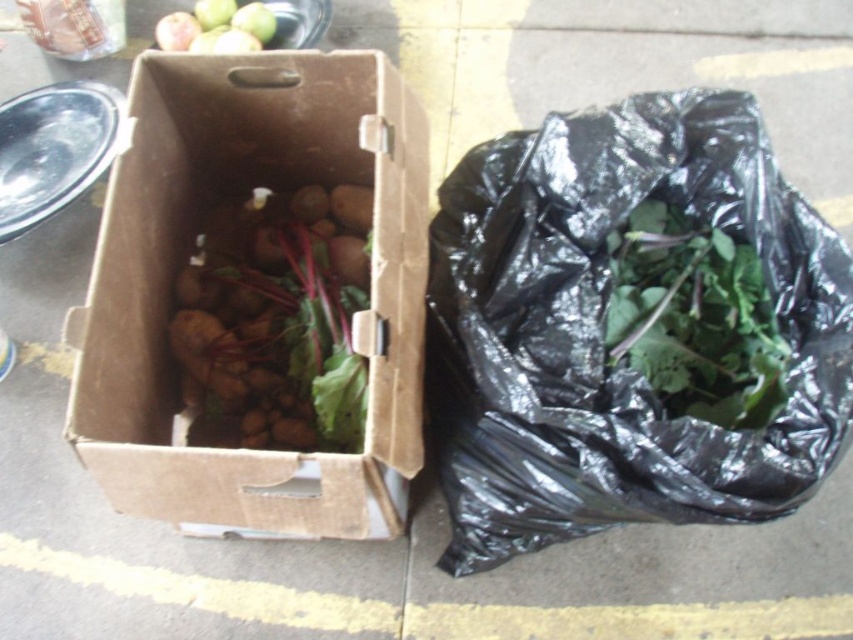
You are a delivery person who needs to pick up the black plastic bag at right and the green leafy at right from the sidewalk. Which item should you pick up first to avoid stepping on the other?

You should pick up the black plastic bag at right first because it is in front of the green leafy at right, so picking it up first will prevent stepping on the green leafy at right when reaching for the other.

You are standing at the origin point of the image. A point labeled as point 1 is located at coordinate [277,321]. What object is located at point 1?

The point labeled as point 1 at coordinate [277,321] indicates the location of brown matte potatoes at center.